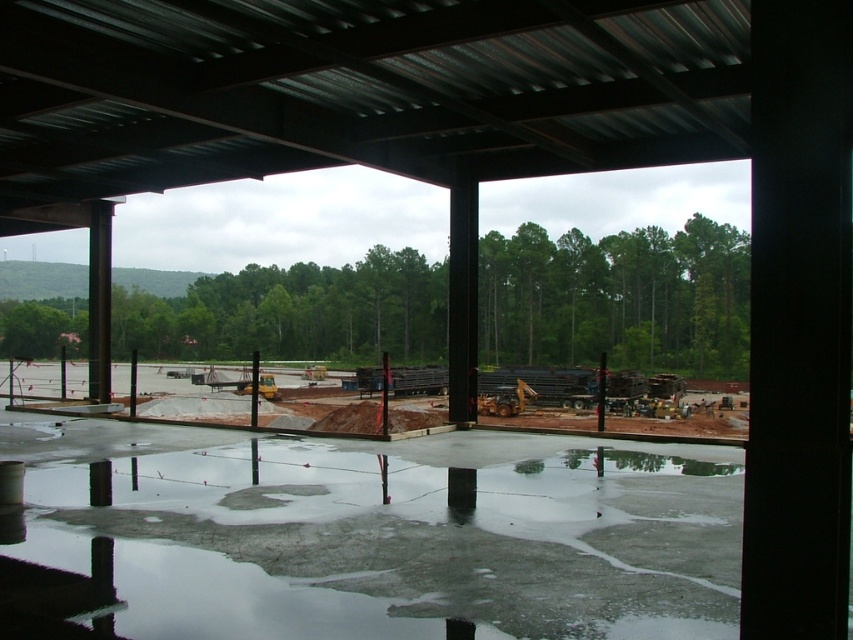
Is glossy concrete flood at lower center taller than metallic pole at left?

Incorrect, glossy concrete flood at lower center's height is not larger of metallic pole at left's.

Who is more forward, (606, 552) or (97, 384)?

Point (606, 552) is in front.

This screenshot has height=640, width=853. Identify the location of glossy concrete flood at lower center. (379, 534).